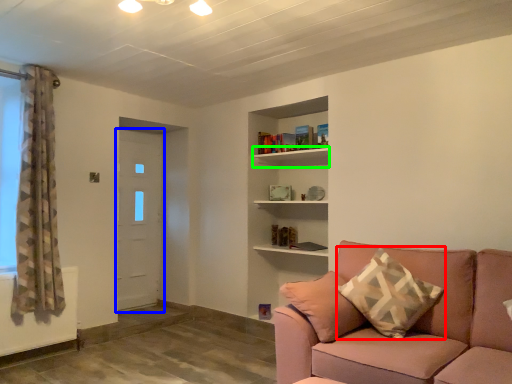
Question: Considering the real-world distances, which object is farthest from pillow (highlighted by a red box)? door (highlighted by a blue box) or shelf (highlighted by a green box)?

Choices:
 (A) door
 (B) shelf

Answer: (A)